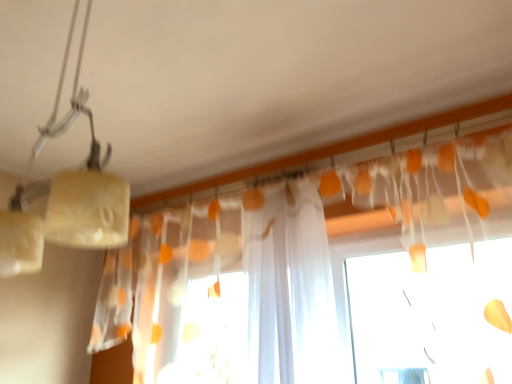
Question: Is matte white lamp at upper left to the right of translucent white curtain at upper center from the viewer's perspective?

Choices:
 (A) yes
 (B) no

Answer: (B)

Question: From a real-world perspective, does matte white lamp at upper left stand above translucent white curtain at upper center?

Choices:
 (A) no
 (B) yes

Answer: (B)

Question: Is matte white lamp at upper left smaller than translucent white curtain at upper center?

Choices:
 (A) yes
 (B) no

Answer: (A)

Question: Are matte white lamp at upper left and translucent white curtain at upper center far apart?

Choices:
 (A) no
 (B) yes

Answer: (B)

Question: From a real-world perspective, does matte white lamp at upper left sit lower than translucent white curtain at upper center?

Choices:
 (A) no
 (B) yes

Answer: (A)

Question: Does matte white lamp at upper left lie in front of translucent white curtain at upper center?

Choices:
 (A) yes
 (B) no

Answer: (A)

Question: From a real-world perspective, does translucent white curtain at upper center sit lower than matte white lamp at upper left?

Choices:
 (A) yes
 (B) no

Answer: (A)

Question: Does translucent white curtain at upper center lie behind matte white lamp at upper left?

Choices:
 (A) no
 (B) yes

Answer: (B)

Question: Could you tell me if translucent white curtain at upper center is turned towards matte white lamp at upper left?

Choices:
 (A) yes
 (B) no

Answer: (A)

Question: From the image's perspective, is translucent white curtain at upper center over matte white lamp at upper left?

Choices:
 (A) no
 (B) yes

Answer: (A)

Question: Can we say translucent white curtain at upper center lies outside matte white lamp at upper left?

Choices:
 (A) no
 (B) yes

Answer: (B)

Question: Is translucent white curtain at upper center positioned before matte white lamp at upper left?

Choices:
 (A) no
 (B) yes

Answer: (A)

Question: Does point (20, 266) appear closer or farther from the camera than point (243, 253)?

Choices:
 (A) farther
 (B) closer

Answer: (B)